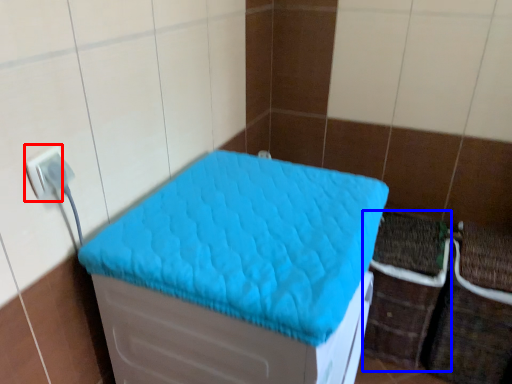
Question: Which object appears closest to the camera in this image, electric outlet (highlighted by a red box) or crate (highlighted by a blue box)?

Choices:
 (A) electric outlet
 (B) crate

Answer: (A)